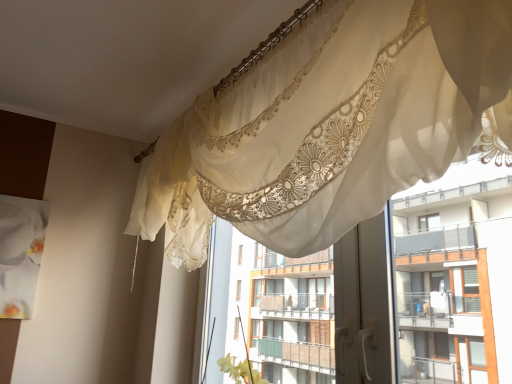
Question: Based on their positions, is sheer lace curtains at upper center located to the left or right of sheer lace curtain at upper center?

Choices:
 (A) left
 (B) right

Answer: (B)

Question: Is point click(416, 205) positioned closer to the camera than point click(209, 162)?

Choices:
 (A) farther
 (B) closer

Answer: (A)

Question: In the image, is sheer lace curtains at upper center positioned in front of or behind sheer lace curtain at upper center?

Choices:
 (A) front
 (B) behind

Answer: (B)

Question: From a real-world perspective, is sheer lace curtain at upper center positioned above or below sheer lace curtains at upper center?

Choices:
 (A) above
 (B) below

Answer: (A)

Question: Is sheer lace curtain at upper center taller or shorter than sheer lace curtains at upper center?

Choices:
 (A) short
 (B) tall

Answer: (A)

Question: Is sheer lace curtain at upper center wider or thinner than sheer lace curtains at upper center?

Choices:
 (A) thin
 (B) wide

Answer: (B)

Question: From the image's perspective, relative to sheer lace curtains at upper center, is sheer lace curtain at upper center above or below?

Choices:
 (A) below
 (B) above

Answer: (B)